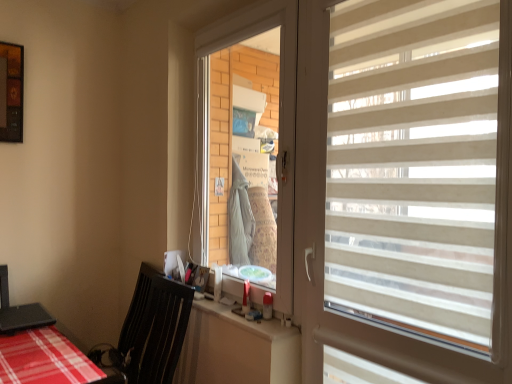
Question: Should I look upward or downward to see white plastic counter top at lower center?

Choices:
 (A) up
 (B) down

Answer: (B)

Question: Can you confirm if transparent plastic window screen at center is taller than white plastic counter top at lower center?

Choices:
 (A) yes
 (B) no

Answer: (A)

Question: Is transparent plastic window screen at center with white plastic counter top at lower center?

Choices:
 (A) yes
 (B) no

Answer: (B)

Question: Considering the relative positions of transparent plastic window screen at center and white plastic counter top at lower center in the image provided, is transparent plastic window screen at center to the right of white plastic counter top at lower center from the viewer's perspective?

Choices:
 (A) no
 (B) yes

Answer: (B)

Question: Can you confirm if transparent plastic window screen at center is shorter than white plastic counter top at lower center?

Choices:
 (A) yes
 (B) no

Answer: (B)

Question: Could you tell me if transparent plastic window screen at center is turned towards white plastic counter top at lower center?

Choices:
 (A) no
 (B) yes

Answer: (A)

Question: Is transparent plastic window screen at center further to the viewer compared to white plastic counter top at lower center?

Choices:
 (A) yes
 (B) no

Answer: (A)

Question: From a real-world perspective, is black plastic swivel chair at lower left physically below white plastic counter top at lower center?

Choices:
 (A) no
 (B) yes

Answer: (B)

Question: Is white plastic counter top at lower center at the back of black plastic swivel chair at lower left?

Choices:
 (A) yes
 (B) no

Answer: (A)

Question: Can you confirm if black plastic swivel chair at lower left is shorter than white plastic counter top at lower center?

Choices:
 (A) no
 (B) yes

Answer: (A)

Question: Is black plastic swivel chair at lower left to the left of white plastic counter top at lower center from the viewer's perspective?

Choices:
 (A) no
 (B) yes

Answer: (B)

Question: Does black plastic swivel chair at lower left contain white plastic counter top at lower center?

Choices:
 (A) yes
 (B) no

Answer: (B)

Question: From the image's perspective, does black plastic swivel chair at lower left appear lower than white plastic counter top at lower center?

Choices:
 (A) yes
 (B) no

Answer: (A)

Question: Is beige striped window blind at right touching black plastic swivel chair at lower left?

Choices:
 (A) yes
 (B) no

Answer: (B)